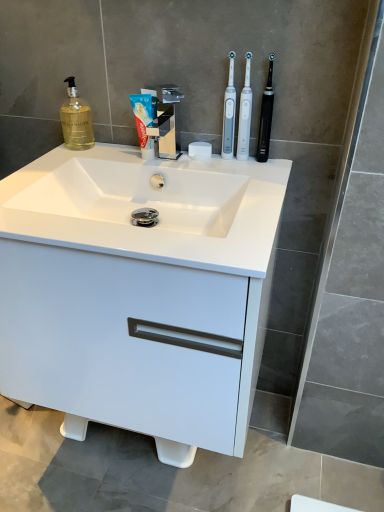
Locate an element on the screen. This screenshot has width=384, height=512. free space to the left of white plastic toothbrush at upper right, arranged as the third toothbrush when viewed from the right is located at coordinates (168, 159).